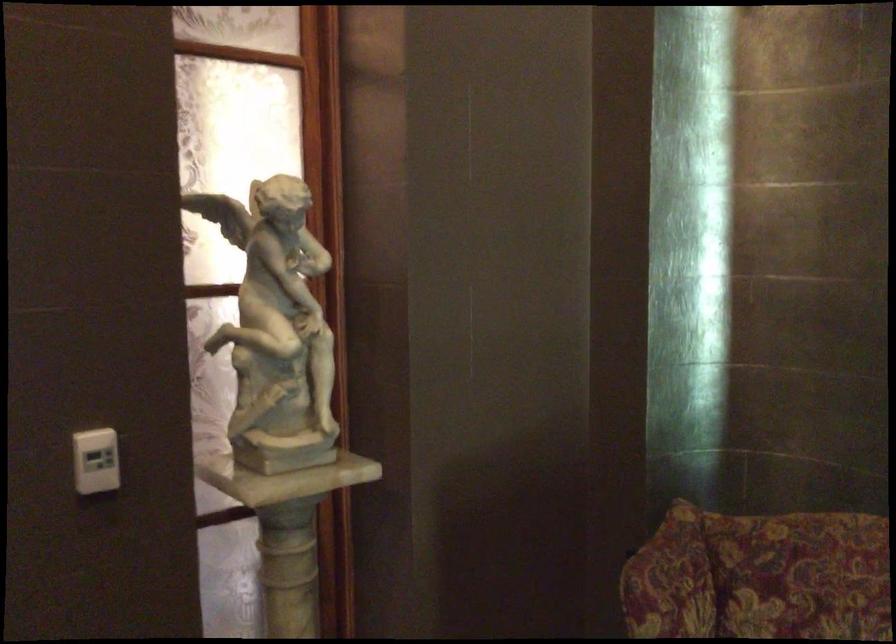
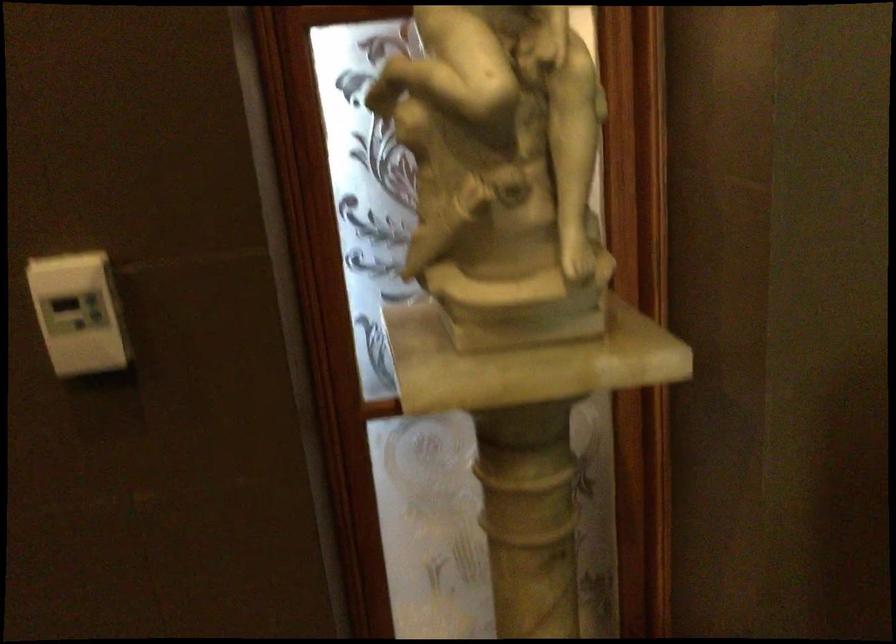
The point at (88, 460) is marked in the first image. Where is the corresponding point in the second image?

(79, 313)